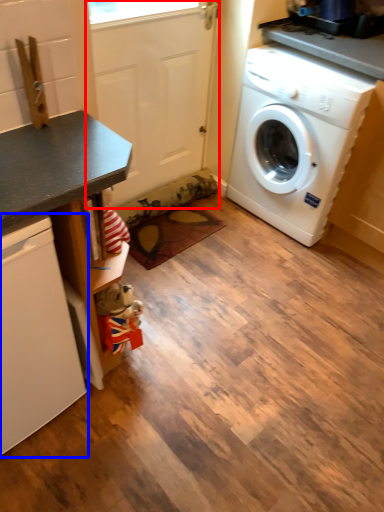
Question: Which object appears closest to the camera in this image, screen door (highlighted by a red box) or dish washer (highlighted by a blue box)?

Choices:
 (A) screen door
 (B) dish washer

Answer: (B)